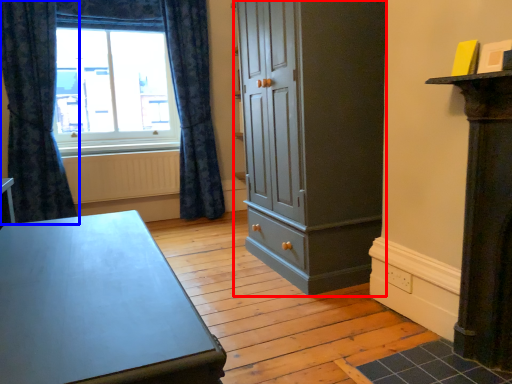
Question: Which of the following is the closest to the observer, cupboard (highlighted by a red box) or curtain (highlighted by a blue box)?

Choices:
 (A) cupboard
 (B) curtain

Answer: (A)